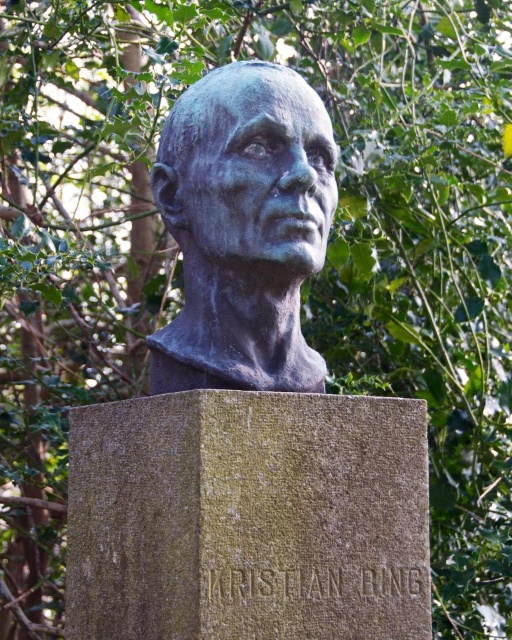
You are standing in a cemetery and see the bronze bust at center and the green stone gravestone at center. Which object is taller?

The bronze bust at center is taller than the green stone gravestone at center.

You are standing in a cemetery and see the bronze bust at center and the green stone gravestone at center. Which object is located directly above the other?

The bronze bust at center is located directly above the green stone gravestone at center because the gravestone is positioned under the bust.

From the picture: You are standing in a cemetery and see the green stone gravestone at center. If you want to place a bouquet of flowers exactly 3 meters away from the gravestone, where should you place it?

Since the green stone gravestone at center is 3.49 meters away from the camera, placing the bouquet 3 meters behind the gravestone would keep it at the desired distance from the gravestone.